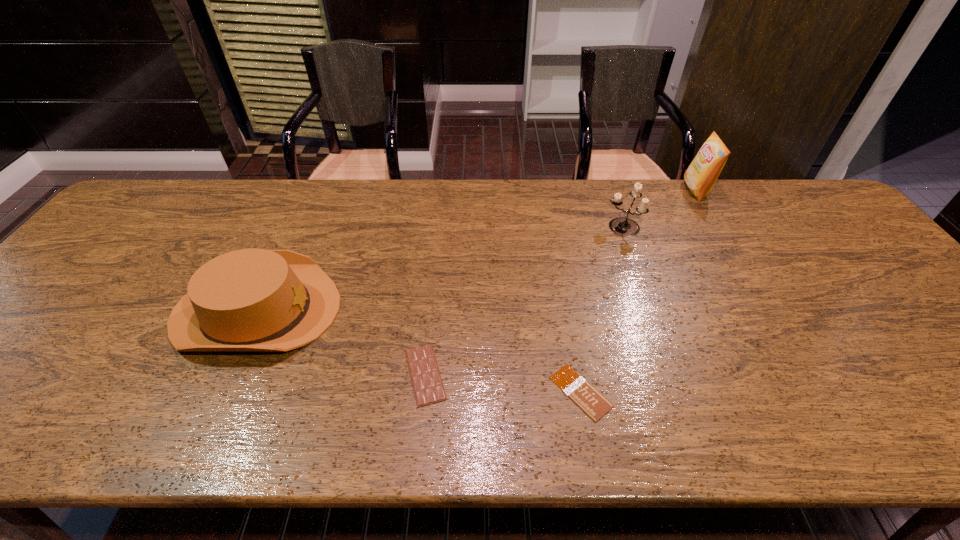
At what (x,y) coordinates should I click in order to perform the action: click on free space located on the front-facing side of the rightmost object. Please return your answer as a coordinate pair (x, y). Looking at the image, I should click on (644, 190).

At what (x,y) coordinates should I click in order to perform the action: click on free space located 0.090m on the front-facing side of the rightmost object. Please return your answer as a coordinate pair (x, y). This screenshot has width=960, height=540. Looking at the image, I should click on (657, 190).

Identify the location of vacant space located on the front-facing side of the rightmost object. The width and height of the screenshot is (960, 540). (660, 190).

This screenshot has height=540, width=960. I want to click on vacant area situated 0.330m on the front of the fourth nearest object, so click(x=659, y=331).

Locate an element on the screen. The width and height of the screenshot is (960, 540). free region located on the front-facing side of the leftmost object is located at coordinates (470, 310).

Where is `vacant region located 0.230m on the back of the taller chocolate bar`? The height and width of the screenshot is (540, 960). vacant region located 0.230m on the back of the taller chocolate bar is located at coordinates click(x=435, y=273).

Where is `vacant space located on the right of the shorter chocolate bar`? The width and height of the screenshot is (960, 540). vacant space located on the right of the shorter chocolate bar is located at coordinates (778, 392).

In order to click on crisp (potato chip) situated at the far edge in this screenshot , I will do [x=701, y=175].

Find the location of a particular element. The image size is (960, 540). candle holder located at the far edge is located at coordinates (622, 226).

Where is `blank space at the far edge of the desktop`? Image resolution: width=960 pixels, height=540 pixels. blank space at the far edge of the desktop is located at coordinates (588, 205).